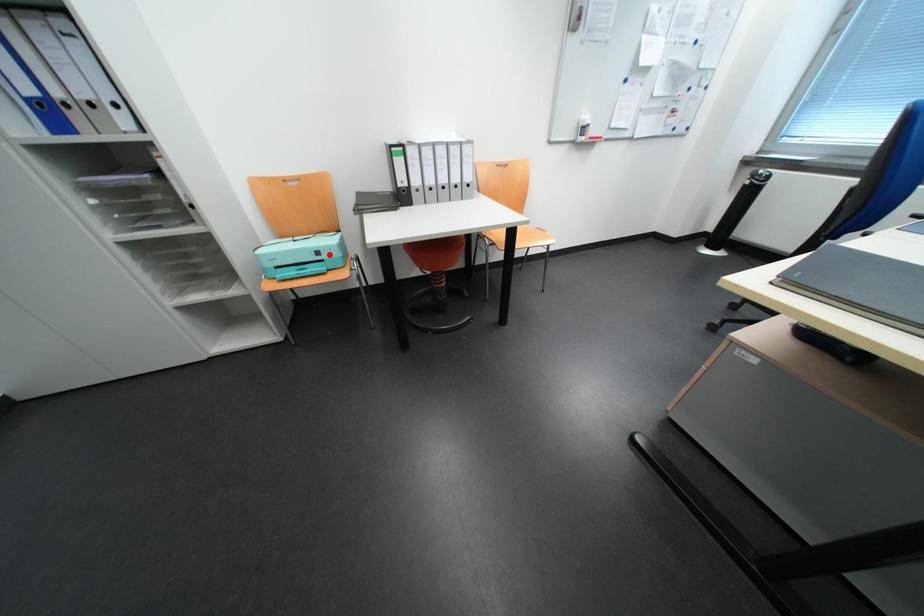
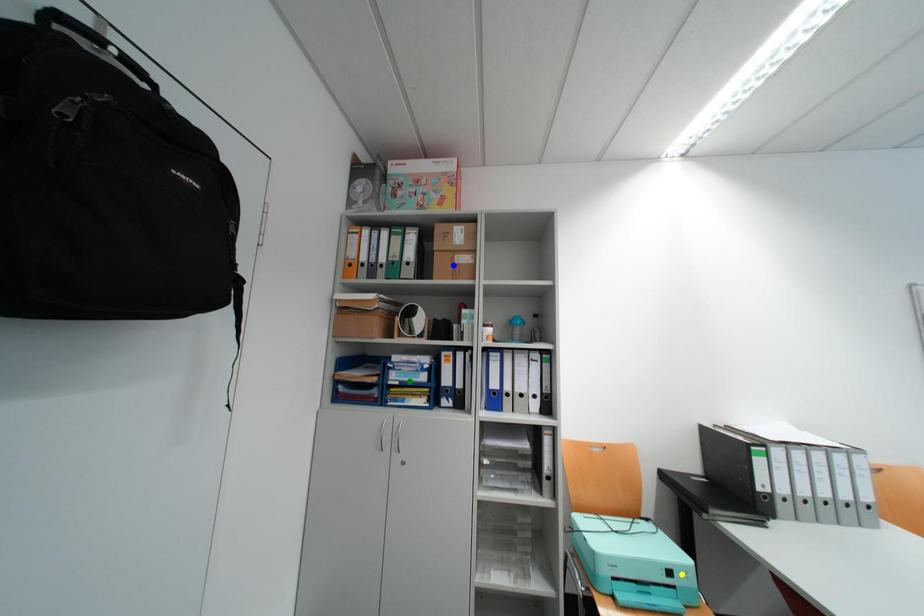
Question: I am providing you with two images of the same scene from different viewpoints. A red point is marked on the first image. You are given multiple points on the second image. In image 2, which mark is for the same physical point as the one in image 1?

Choices:
 (A) blue point
 (B) yellow point
 (C) green point

Answer: (B)